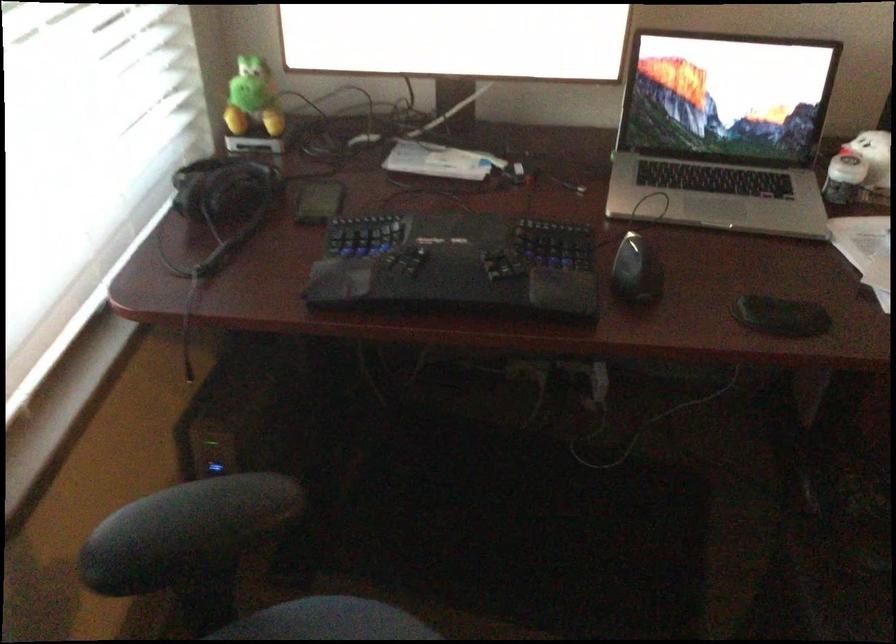
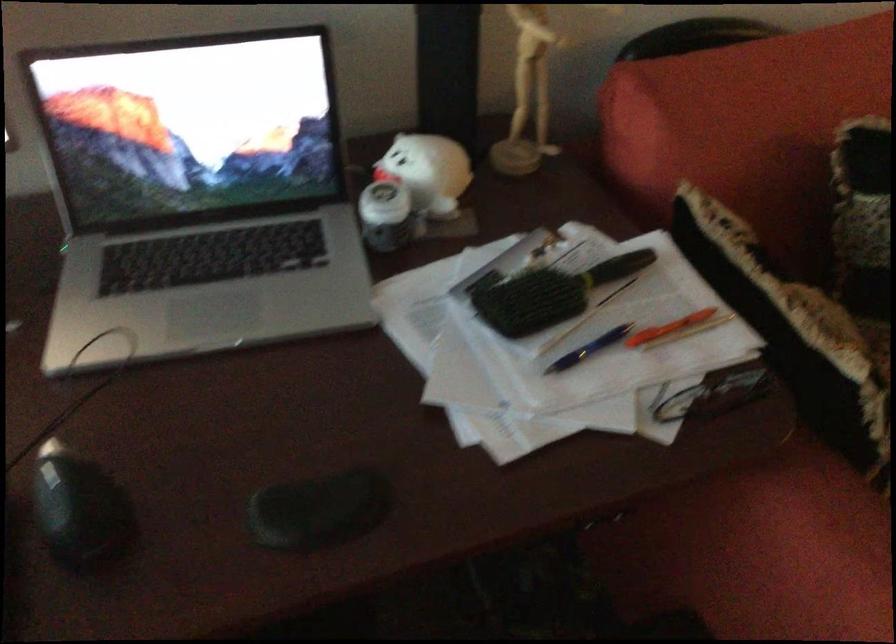
Question: How did the camera likely rotate?

Choices:
 (A) Left
 (B) Right
 (C) Up
 (D) Down

Answer: (B)